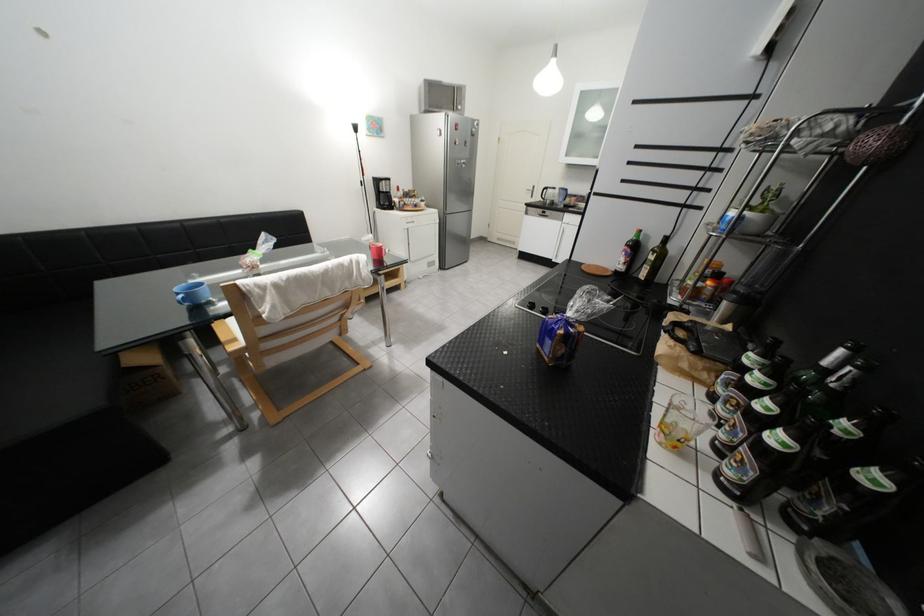
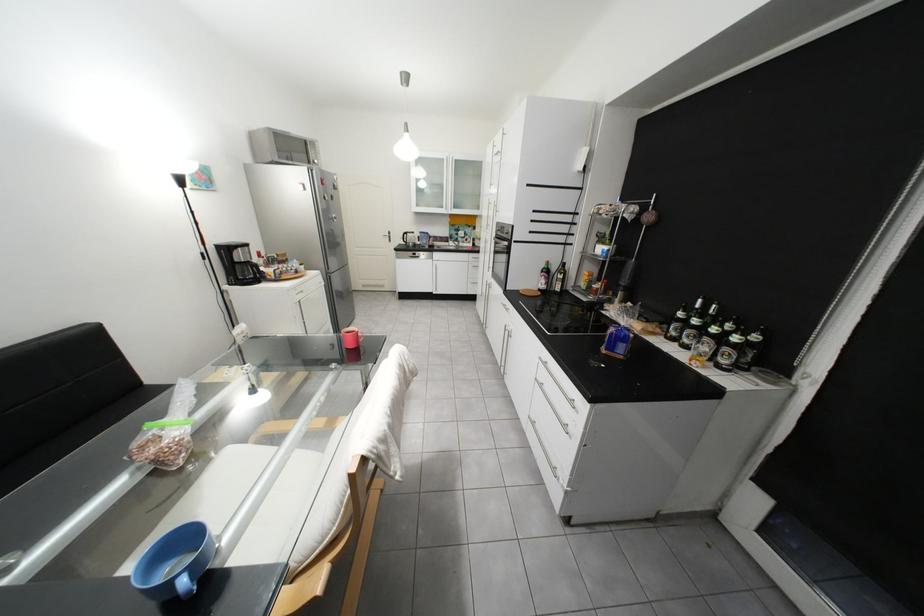
The point at (573, 207) is marked in the first image. Where is the corresponding point in the second image?

(439, 248)